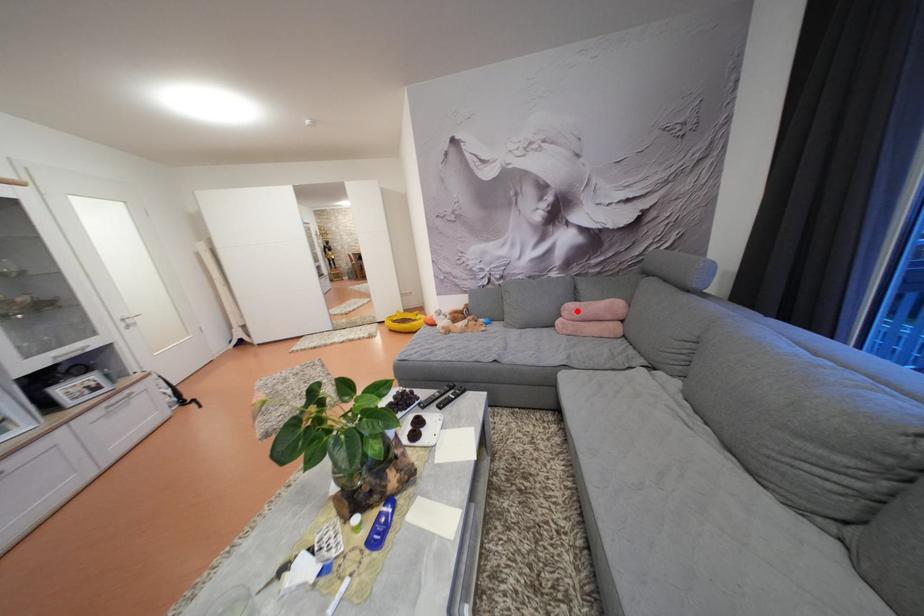
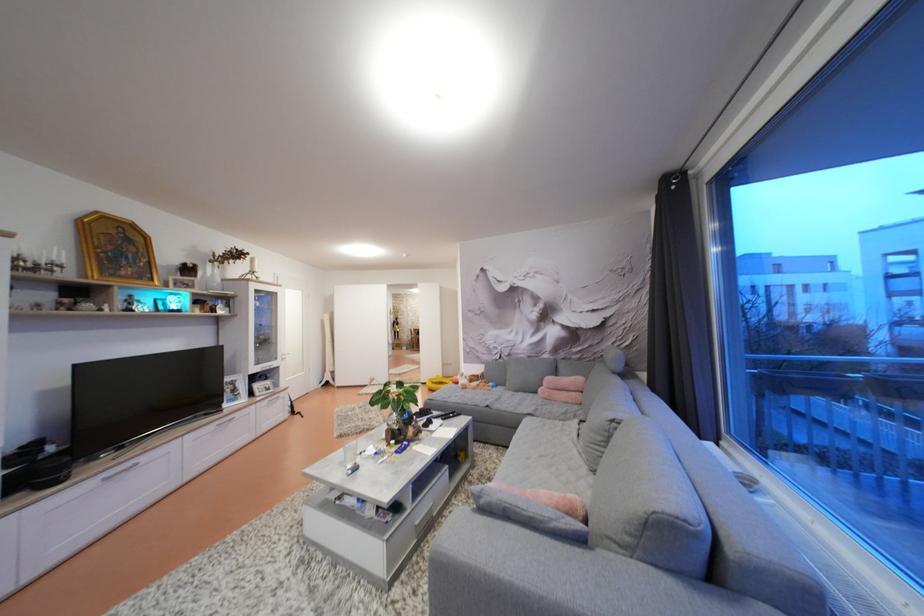
Question: A red point is marked in image1. In image2, is the corresponding 3D point closer to the camera or farther? Reply with the corresponding letter.

Choices:
 (A) The corresponding 3D point is closer.
 (B) The corresponding 3D point is farther.

Answer: (B)